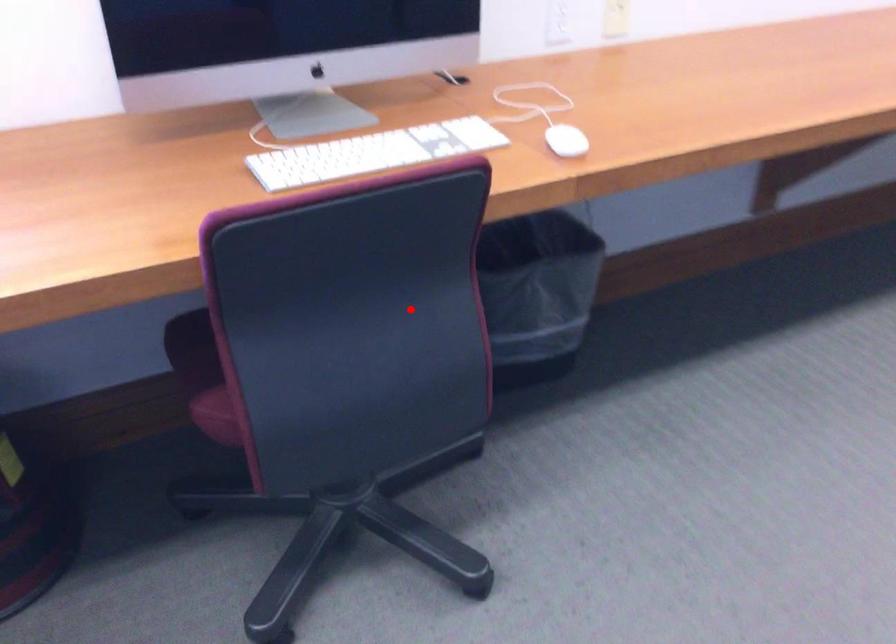
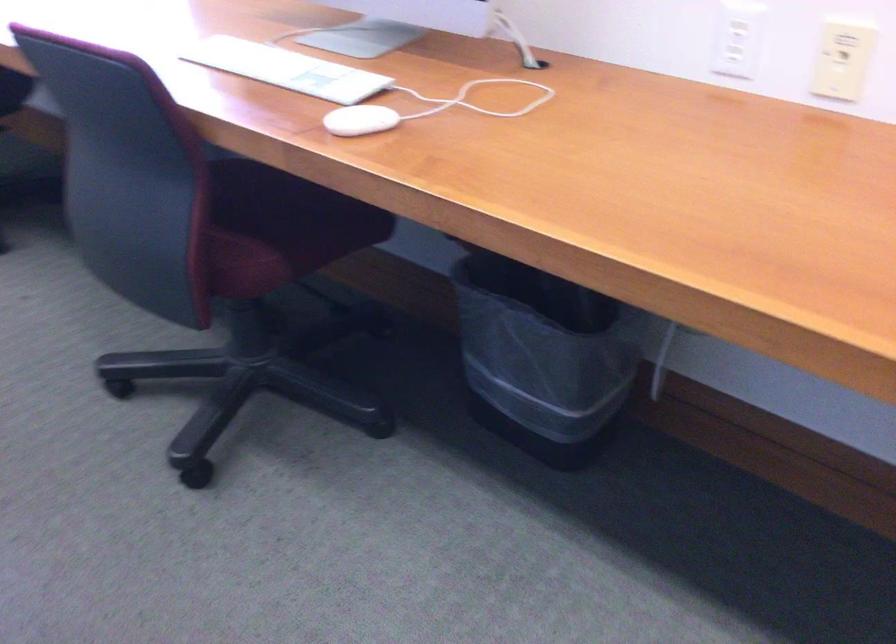
The point at the highlighted location is marked in the first image. Where is the corresponding point in the second image?

(273, 228)